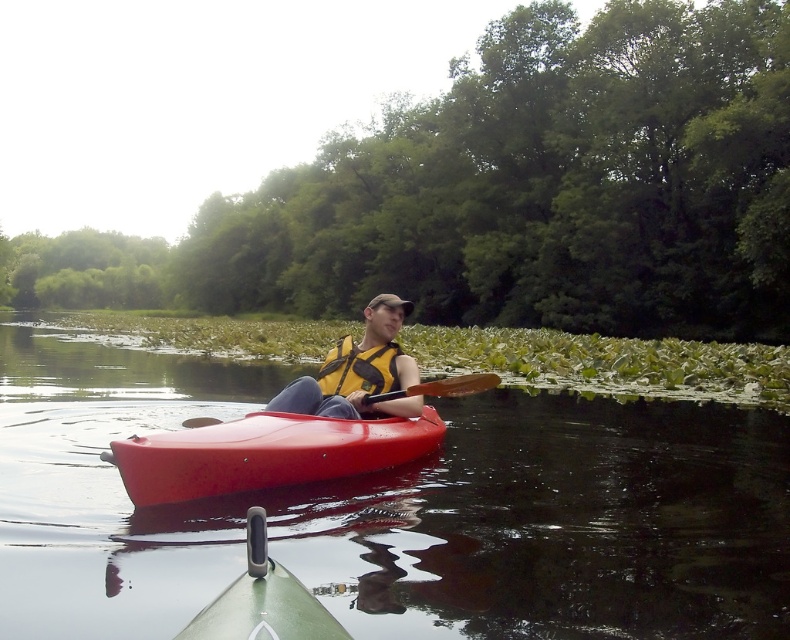
Question: Is yellow life vest at center below yellow fabric life jacket at center?

Choices:
 (A) no
 (B) yes

Answer: (B)

Question: Can you confirm if yellow life vest at center is bigger than yellow fabric life jacket at center?

Choices:
 (A) no
 (B) yes

Answer: (B)

Question: Which point is closer to the camera?

Choices:
 (A) yellow life vest at center
 (B) yellow fabric life jacket at center
 (C) brown wooden paddle at center

Answer: (C)

Question: Based on their relative distances, which object is farther from the matte red canoe at center?

Choices:
 (A) glossy plastic kayak at center
 (B) yellow fabric life jacket at center

Answer: (A)

Question: Does matte red canoe at center lie behind yellow fabric life jacket at center?

Choices:
 (A) no
 (B) yes

Answer: (A)

Question: Which object is the farthest from the yellow life vest at center?

Choices:
 (A) matte red canoe at center
 (B) yellow fabric life jacket at center

Answer: (A)